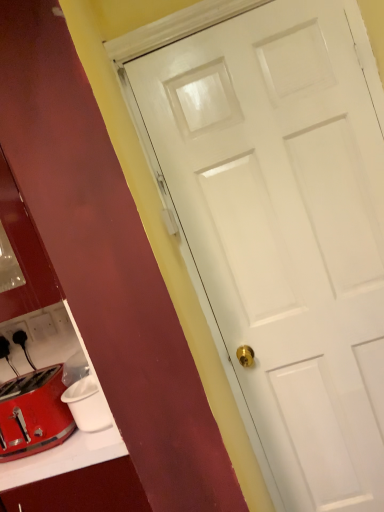
Where is `white plastic electric outlet at lower left, positioned as the first electric outlet in right-to-left order`? The height and width of the screenshot is (512, 384). white plastic electric outlet at lower left, positioned as the first electric outlet in right-to-left order is located at coordinates (42, 326).

The image size is (384, 512). Describe the element at coordinates (42, 326) in the screenshot. I see `white plastic electric outlet at lower left, which is the second electric outlet from left to right` at that location.

Find the location of a particular element. The width and height of the screenshot is (384, 512). black plastic electric outlet at lower left, positioned as the 1th electric outlet in left-to-right order is located at coordinates (13, 333).

Locate an element on the screen. The height and width of the screenshot is (512, 384). white plastic electric outlet at lower left, positioned as the first electric outlet in right-to-left order is located at coordinates (42, 326).

Which is behind, point (15, 354) or point (22, 433)?

The point (15, 354) is farther from the camera.

Relative to shiny metallic toaster at lower left, is black plastic electric outlet at lower left, positioned as the 1th electric outlet in left-to-right order, in front or behind?

In the image, black plastic electric outlet at lower left, positioned as the 1th electric outlet in left-to-right order, appears behind shiny metallic toaster at lower left.

Which object is wider, black plastic electric outlet at lower left, arranged as the 2th electric outlet when viewed from the right, or shiny metallic toaster at lower left?

shiny metallic toaster at lower left is wider.

From a real-world perspective, is black plastic electric outlet at lower left, positioned as the 1th electric outlet in left-to-right order, beneath shiny metallic toaster at lower left?

No, from a real-world perspective, black plastic electric outlet at lower left, positioned as the 1th electric outlet in left-to-right order, is not below shiny metallic toaster at lower left.

Based on their sizes in the image, would you say white plastic electric outlet at lower left, positioned as the first electric outlet in right-to-left order, is bigger or smaller than black plastic electric outlet at lower left, arranged as the 2th electric outlet when viewed from the right?

white plastic electric outlet at lower left, positioned as the first electric outlet in right-to-left order, is smaller than black plastic electric outlet at lower left, arranged as the 2th electric outlet when viewed from the right.

From the image's perspective, would you say white plastic electric outlet at lower left, which is the second electric outlet from left to right, is shown under black plastic electric outlet at lower left, arranged as the 2th electric outlet when viewed from the right?

Result: No.

Can you confirm if white plastic electric outlet at lower left, which is the second electric outlet from left to right, is thinner than black plastic electric outlet at lower left, arranged as the 2th electric outlet when viewed from the right?

Incorrect, the width of white plastic electric outlet at lower left, which is the second electric outlet from left to right, is not less than that of black plastic electric outlet at lower left, arranged as the 2th electric outlet when viewed from the right.

Measure the distance from white plastic electric outlet at lower left, which is the second electric outlet from left to right, to black plastic electric outlet at lower left, positioned as the 1th electric outlet in left-to-right order.

white plastic electric outlet at lower left, which is the second electric outlet from left to right, is 2.69 inches away from black plastic electric outlet at lower left, positioned as the 1th electric outlet in left-to-right order.

Is black plastic electric outlet at lower left, arranged as the 2th electric outlet when viewed from the right, facing away from white plastic electric outlet at lower left, positioned as the first electric outlet in right-to-left order?

That's not correct — black plastic electric outlet at lower left, arranged as the 2th electric outlet when viewed from the right, is not looking away from white plastic electric outlet at lower left, positioned as the first electric outlet in right-to-left order.

Is black plastic electric outlet at lower left, arranged as the 2th electric outlet when viewed from the right, not near white plastic electric outlet at lower left, positioned as the first electric outlet in right-to-left order?

No, there isn't a large distance between black plastic electric outlet at lower left, arranged as the 2th electric outlet when viewed from the right, and white plastic electric outlet at lower left, positioned as the first electric outlet in right-to-left order.

Does black plastic electric outlet at lower left, arranged as the 2th electric outlet when viewed from the right, have a lesser width compared to white plastic electric outlet at lower left, positioned as the first electric outlet in right-to-left order?

Indeed, black plastic electric outlet at lower left, arranged as the 2th electric outlet when viewed from the right, has a lesser width compared to white plastic electric outlet at lower left, positioned as the first electric outlet in right-to-left order.

Who is smaller, black plastic electric outlet at lower left, positioned as the 1th electric outlet in left-to-right order, or white plastic electric outlet at lower left, which is the second electric outlet from left to right?

With smaller size is white plastic electric outlet at lower left, which is the second electric outlet from left to right.

From their relative heights in the image, would you say shiny metallic toaster at lower left is taller or shorter than black plastic electric outlet at lower left, arranged as the 2th electric outlet when viewed from the right?

In the image, shiny metallic toaster at lower left appears to be taller than black plastic electric outlet at lower left, arranged as the 2th electric outlet when viewed from the right.

How distant is shiny metallic toaster at lower left from black plastic electric outlet at lower left, arranged as the 2th electric outlet when viewed from the right?

shiny metallic toaster at lower left and black plastic electric outlet at lower left, arranged as the 2th electric outlet when viewed from the right, are 13.77 inches apart from each other.

In the image, is shiny metallic toaster at lower left on the left side or the right side of black plastic electric outlet at lower left, arranged as the 2th electric outlet when viewed from the right?

From the image, it's evident that shiny metallic toaster at lower left is to the right of black plastic electric outlet at lower left, arranged as the 2th electric outlet when viewed from the right.

From a real-world perspective, does shiny metallic toaster at lower left sit lower than black plastic electric outlet at lower left, arranged as the 2th electric outlet when viewed from the right?

Correct, in the physical world, shiny metallic toaster at lower left is lower than black plastic electric outlet at lower left, arranged as the 2th electric outlet when viewed from the right.

Considering the sizes of objects shiny metallic toaster at lower left and white plastic electric outlet at lower left, positioned as the first electric outlet in right-to-left order, in the image provided, who is thinner, shiny metallic toaster at lower left or white plastic electric outlet at lower left, positioned as the first electric outlet in right-to-left order,?

white plastic electric outlet at lower left, positioned as the first electric outlet in right-to-left order, is thinner.

Is shiny metallic toaster at lower left to the left of white plastic electric outlet at lower left, which is the second electric outlet from left to right, from the viewer's perspective?

No, shiny metallic toaster at lower left is not to the left of white plastic electric outlet at lower left, which is the second electric outlet from left to right.

Is shiny metallic toaster at lower left taller than white plastic electric outlet at lower left, positioned as the first electric outlet in right-to-left order?

Yes.

Which is more to the left, white plastic electric outlet at lower left, which is the second electric outlet from left to right, or shiny metallic toaster at lower left?

Positioned to the left is white plastic electric outlet at lower left, which is the second electric outlet from left to right.

From the image's perspective, which one is positioned lower, white plastic electric outlet at lower left, positioned as the first electric outlet in right-to-left order, or shiny metallic toaster at lower left?

shiny metallic toaster at lower left is shown below in the image.

Is white plastic electric outlet at lower left, positioned as the first electric outlet in right-to-left order, with shiny metallic toaster at lower left?

white plastic electric outlet at lower left, positioned as the first electric outlet in right-to-left order, and shiny metallic toaster at lower left are not in contact.

Considering the relative positions of white plastic electric outlet at lower left, which is the second electric outlet from left to right, and shiny metallic toaster at lower left in the image provided, is white plastic electric outlet at lower left, which is the second electric outlet from left to right, behind shiny metallic toaster at lower left?

Yes, white plastic electric outlet at lower left, which is the second electric outlet from left to right, is further from the viewer.

Find the location of a particular element. toaster on the right side of black plastic electric outlet at lower left, positioned as the 1th electric outlet in left-to-right order is located at coordinates (33, 414).

Image resolution: width=384 pixels, height=512 pixels. Identify the location of electric outlet that is behind the white plastic electric outlet at lower left, positioned as the first electric outlet in right-to-left order. (13, 333).

Which object lies further to the anchor point shiny metallic toaster at lower left, white plastic electric outlet at lower left, positioned as the first electric outlet in right-to-left order, or black plastic electric outlet at lower left, arranged as the 2th electric outlet when viewed from the right?

black plastic electric outlet at lower left, arranged as the 2th electric outlet when viewed from the right.

When comparing their distances from black plastic electric outlet at lower left, positioned as the 1th electric outlet in left-to-right order, does white plastic electric outlet at lower left, which is the second electric outlet from left to right, or shiny metallic toaster at lower left seem closer?

Based on the image, white plastic electric outlet at lower left, which is the second electric outlet from left to right, appears to be nearer to black plastic electric outlet at lower left, positioned as the 1th electric outlet in left-to-right order.

Looking at the image, which one is located further to shiny metallic toaster at lower left, black plastic electric outlet at lower left, positioned as the 1th electric outlet in left-to-right order, or white plastic electric outlet at lower left, positioned as the first electric outlet in right-to-left order?

black plastic electric outlet at lower left, positioned as the 1th electric outlet in left-to-right order, is further to shiny metallic toaster at lower left.

From the image, which object appears to be farther from white plastic electric outlet at lower left, which is the second electric outlet from left to right, shiny metallic toaster at lower left or black plastic electric outlet at lower left, positioned as the 1th electric outlet in left-to-right order?

shiny metallic toaster at lower left lies further to white plastic electric outlet at lower left, which is the second electric outlet from left to right, than the other object.

Based on their spatial positions, is shiny metallic toaster at lower left or white plastic electric outlet at lower left, which is the second electric outlet from left to right, closer to black plastic electric outlet at lower left, positioned as the 1th electric outlet in left-to-right order?

white plastic electric outlet at lower left, which is the second electric outlet from left to right.

When comparing their distances from white plastic electric outlet at lower left, which is the second electric outlet from left to right, does black plastic electric outlet at lower left, positioned as the 1th electric outlet in left-to-right order, or shiny metallic toaster at lower left seem further?

shiny metallic toaster at lower left is positioned further to the anchor white plastic electric outlet at lower left, which is the second electric outlet from left to right.

I want to click on electric outlet between shiny metallic toaster at lower left and black plastic electric outlet at lower left, arranged as the 2th electric outlet when viewed from the right, in the front-back direction, so click(x=42, y=326).